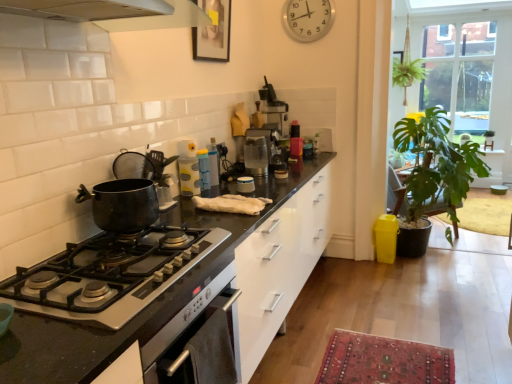
Where is `free space in front of matte black pot at left`? The height and width of the screenshot is (384, 512). free space in front of matte black pot at left is located at coordinates [x=120, y=254].